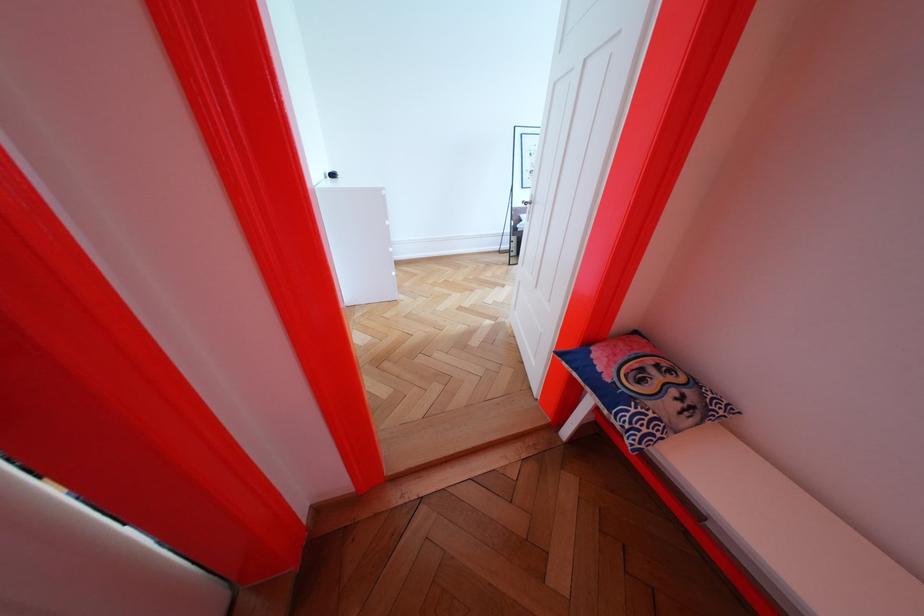
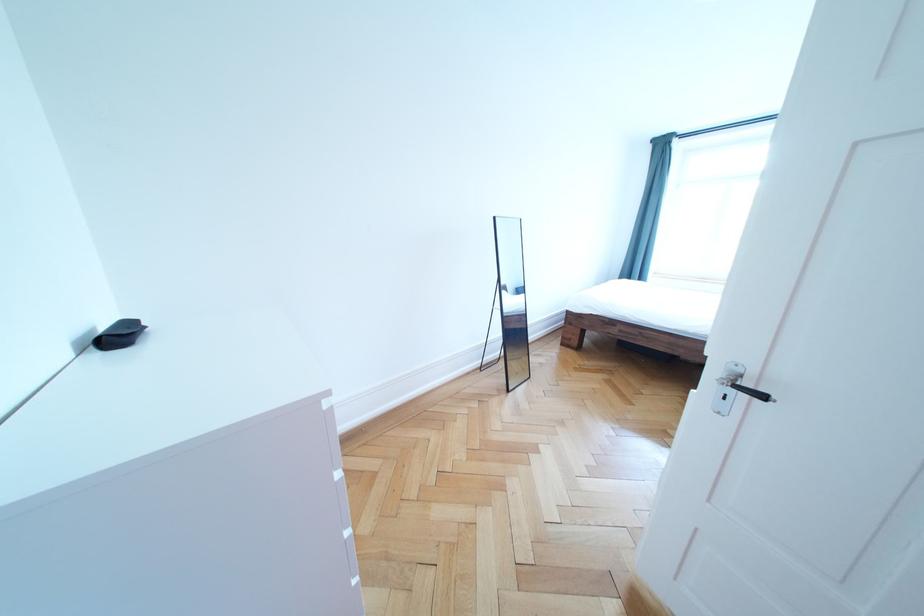
The images are taken continuously from a first-person perspective. In which direction are you moving?

The cameraman moved toward left, forward.